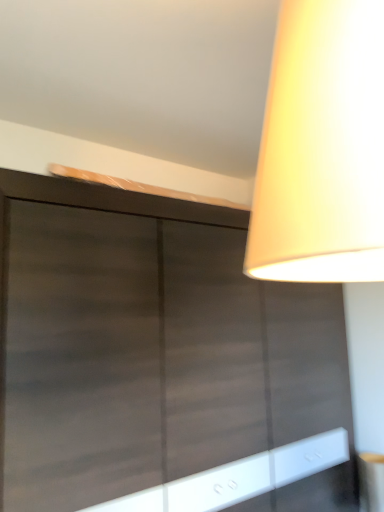
I want to click on dark wood dresser at upper center, so click(161, 360).

What do you see at coordinates (161, 360) in the screenshot?
I see `dark wood dresser at upper center` at bounding box center [161, 360].

You are a GUI agent. You are given a task and a screenshot of the screen. Output one action in this format:
    pyautogui.click(x=<x>, y=<y>)
    Task: Click on the dark wood dresser at upper center
    This screenshot has width=384, height=512.
    Given the screenshot: What is the action you would take?
    pyautogui.click(x=161, y=360)